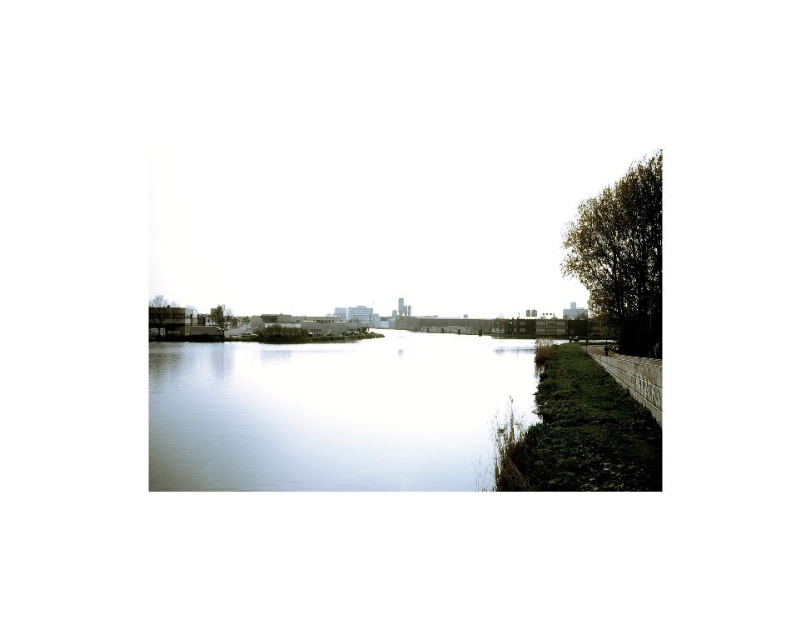
Question: Which of the following is the closest to the observer?

Choices:
 (A) (212, 308)
 (B) (445, 371)
 (C) (642, 170)

Answer: (C)

Question: Is smooth water at center wider than green leafy tree at left?

Choices:
 (A) yes
 (B) no

Answer: (A)

Question: Does smooth water at center appear under green leafy tree at right?

Choices:
 (A) no
 (B) yes

Answer: (B)

Question: Among these points, which one is nearest to the camera?

Choices:
 (A) (561, 268)
 (B) (217, 321)

Answer: (A)

Question: Is green leafy tree at right smaller than green leafy tree at left?

Choices:
 (A) yes
 (B) no

Answer: (B)

Question: Based on their relative distances, which object is farther from the smooth water at center?

Choices:
 (A) green leafy tree at left
 (B) green leafy tree at right

Answer: (A)